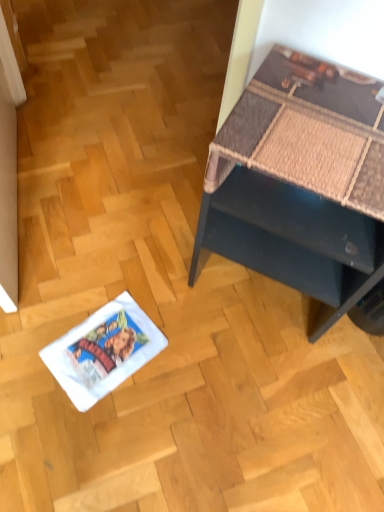
Image resolution: width=384 pixels, height=512 pixels. I want to click on empty space that is to the right of white paper comic book at lower left, so point(175,359).